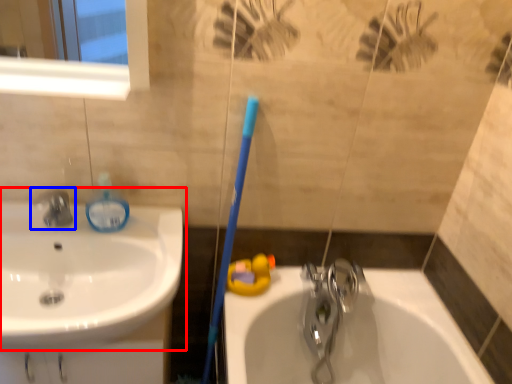
Question: Which object appears closest to the camera in this image, sink (highlighted by a red box) or tap (highlighted by a blue box)?

Choices:
 (A) sink
 (B) tap

Answer: (A)